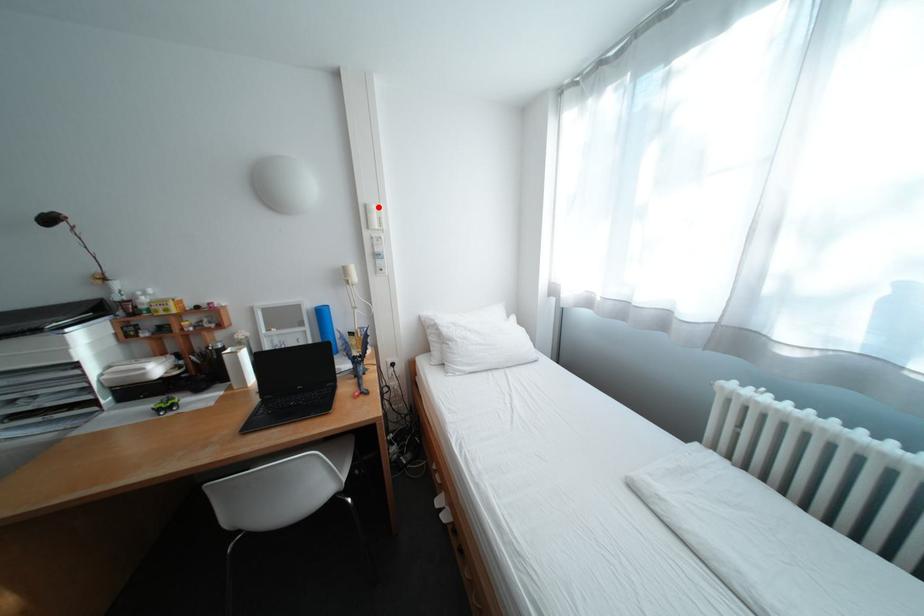
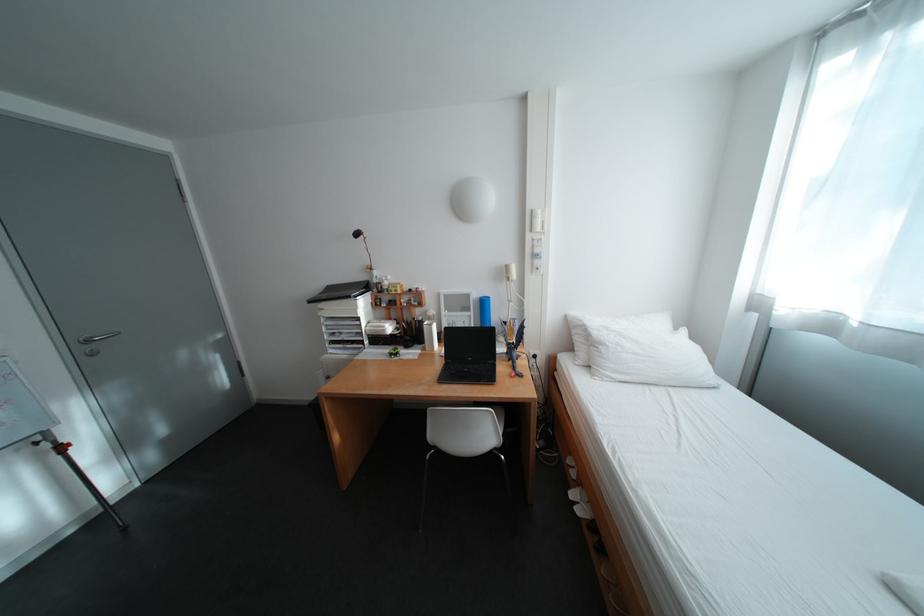
In the second image, find the point that corresponds to the highlighted location in the first image.

(544, 213)